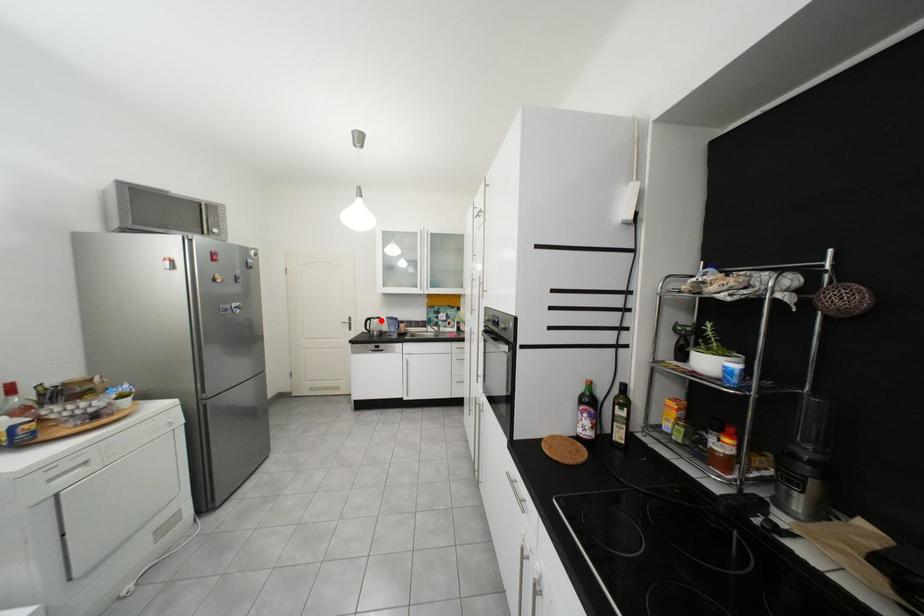
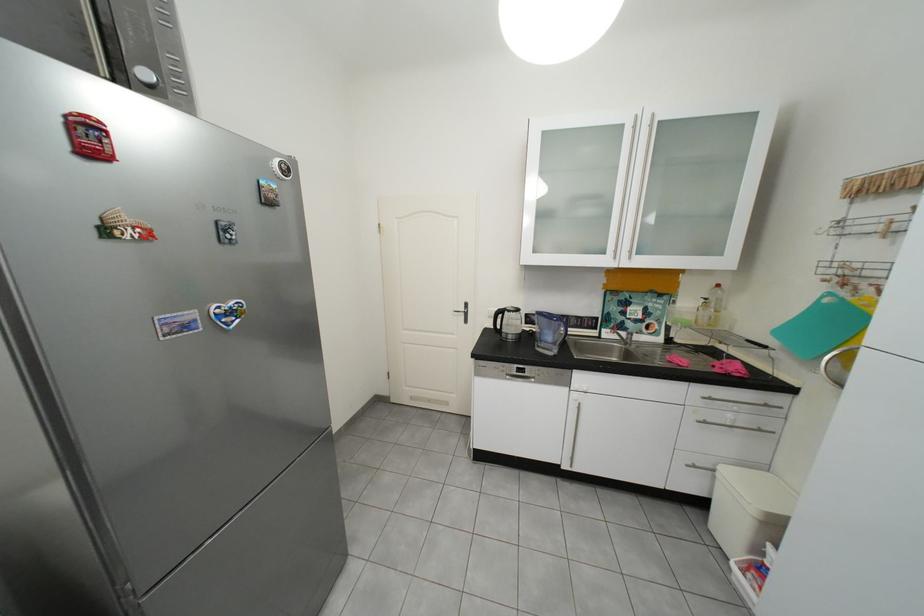
Locate, in the second image, the point that corresponds to the highlighted location in the first image.

(513, 313)